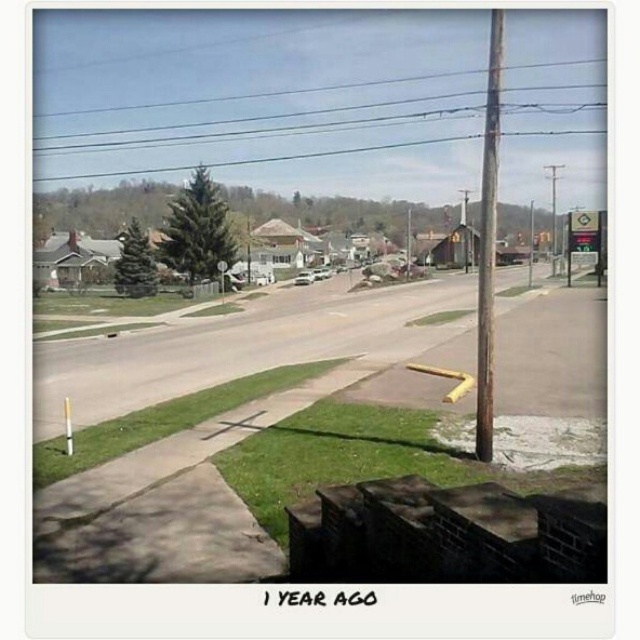
Question: Can you confirm if brown wooden pole at center-right is positioned to the left of green plastic sign at upper right?

Choices:
 (A) yes
 (B) no

Answer: (A)

Question: Based on their relative distances, which object is nearer to the metallic pole at right?

Choices:
 (A) green plastic sign at upper right
 (B) brown wooden pole at center-right

Answer: (A)

Question: Among these points, which one is nearest to the camera?

Choices:
 (A) (596, 268)
 (B) (476, 403)
 (C) (532, 208)

Answer: (B)

Question: Estimate the real-world distances between objects in this image. Which object is closer to the metallic pole at right?

Choices:
 (A) brown wooden pole at center-right
 (B) green plastic sign at upper right

Answer: (B)

Question: Is brown wooden pole at center-right wider than metallic pole at right?

Choices:
 (A) no
 (B) yes

Answer: (A)

Question: Does brown wooden pole at center-right lie behind metallic pole at right?

Choices:
 (A) no
 (B) yes

Answer: (A)